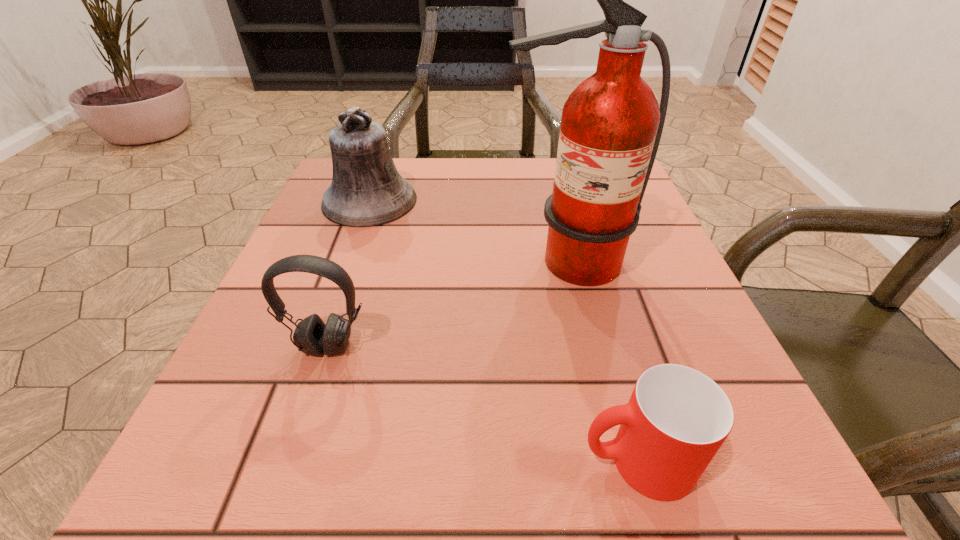
This screenshot has width=960, height=540. Find the location of `the third nearest object`. the third nearest object is located at coordinates pos(611,125).

Find the location of a particular element. This screenshot has height=540, width=960. the tallest object is located at coordinates tap(611, 125).

Find the location of a particular element. The image size is (960, 540). the second tallest object is located at coordinates (366, 190).

Identify the location of the farthest object. (366, 190).

Identify the location of the second shortest object. This screenshot has height=540, width=960. (311, 336).

Where is `headset`? This screenshot has width=960, height=540. headset is located at coordinates (311, 336).

Where is `cup`? cup is located at coordinates (677, 418).

The width and height of the screenshot is (960, 540). What are the coordinates of `the shortest object` in the screenshot? It's located at (677, 418).

Locate an element on the screen. Image resolution: width=960 pixels, height=540 pixels. free space located on the nozzle and handle of the second farthest object is located at coordinates (607, 443).

This screenshot has height=540, width=960. Find the location of `free location located 0.370m on the right of the third shortest object`. free location located 0.370m on the right of the third shortest object is located at coordinates (583, 201).